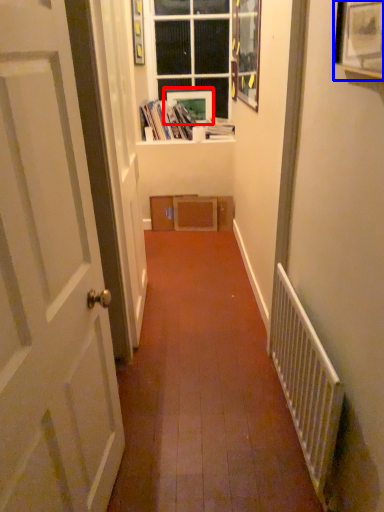
Question: Which object appears farthest to the camera in this image, picture frame (highlighted by a red box) or picture frame (highlighted by a blue box)?

Choices:
 (A) picture frame
 (B) picture frame

Answer: (A)